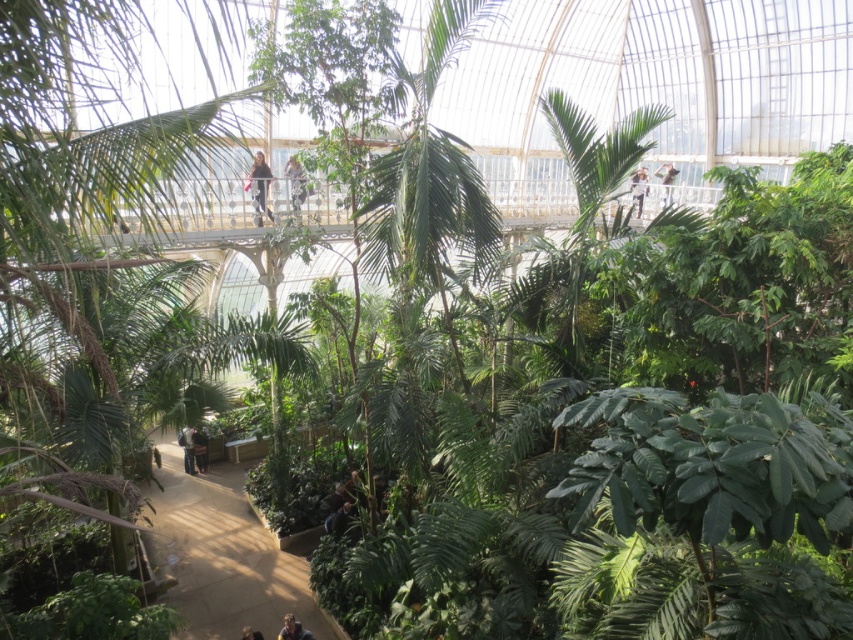
Based on the photo, you are a visitor in the greenhouse and see both the light brown leather jacket at upper center and the white fabric at upper center. Which one is larger in size?

The light brown leather jacket at upper center is bigger than the white fabric at upper center.

You are planning to install a decorative light above the sandy beige pathway at lower center and the white fabric at upper center. Based on their positions, which object should the light be placed closer to?

The light should be placed closer to the sandy beige pathway at lower center because it is taller than the white fabric at upper center.